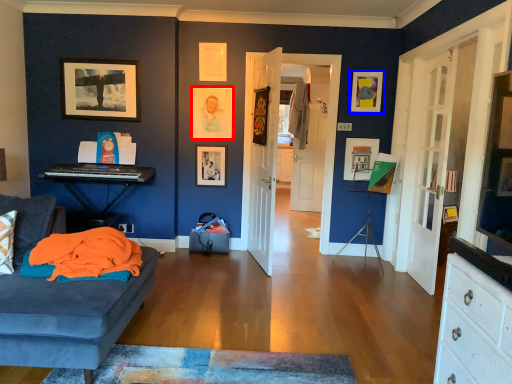
Question: Which object is closer to the camera taking this photo, picture frame (highlighted by a red box) or picture frame (highlighted by a blue box)?

Choices:
 (A) picture frame
 (B) picture frame

Answer: (B)